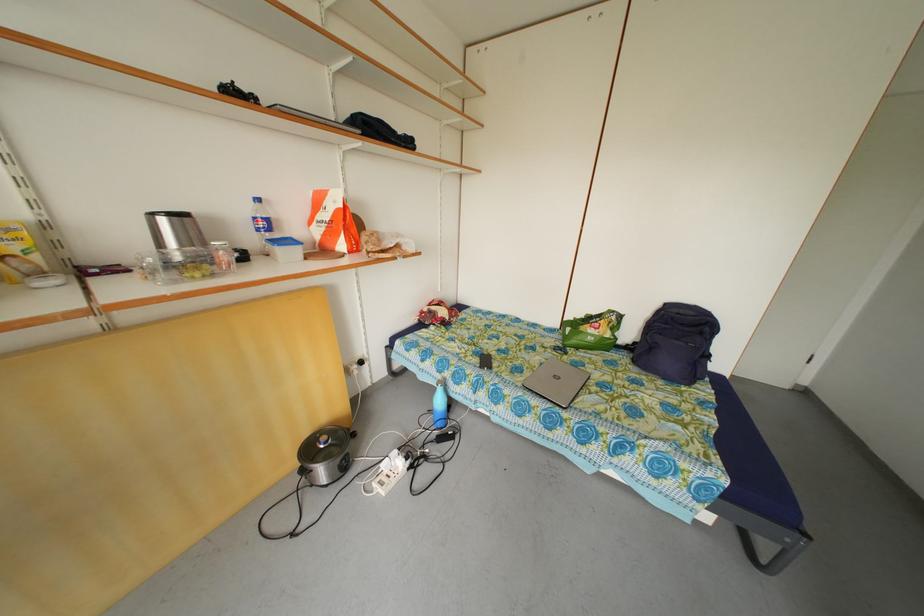
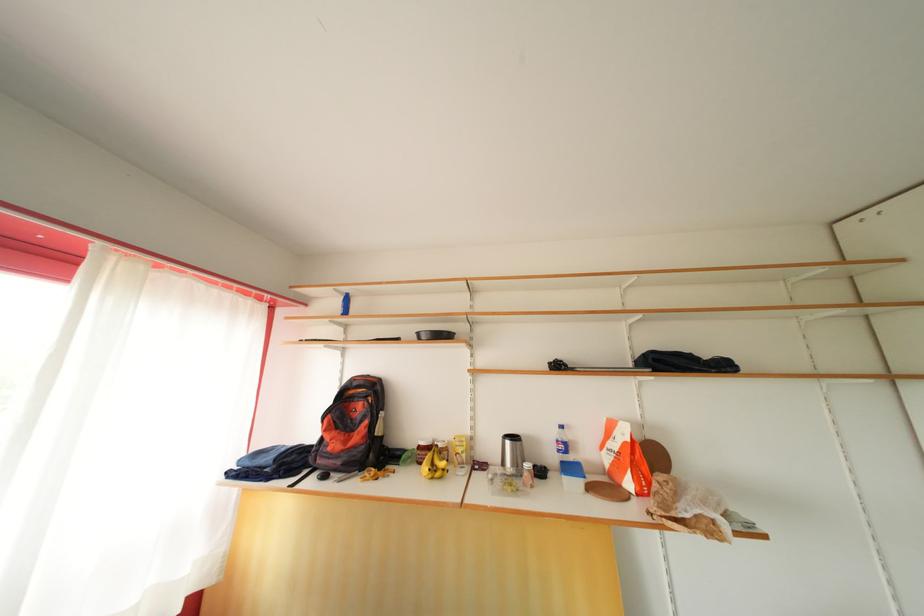
Where in the second image is the point corresponding to (171,227) from the first image?

(515, 448)